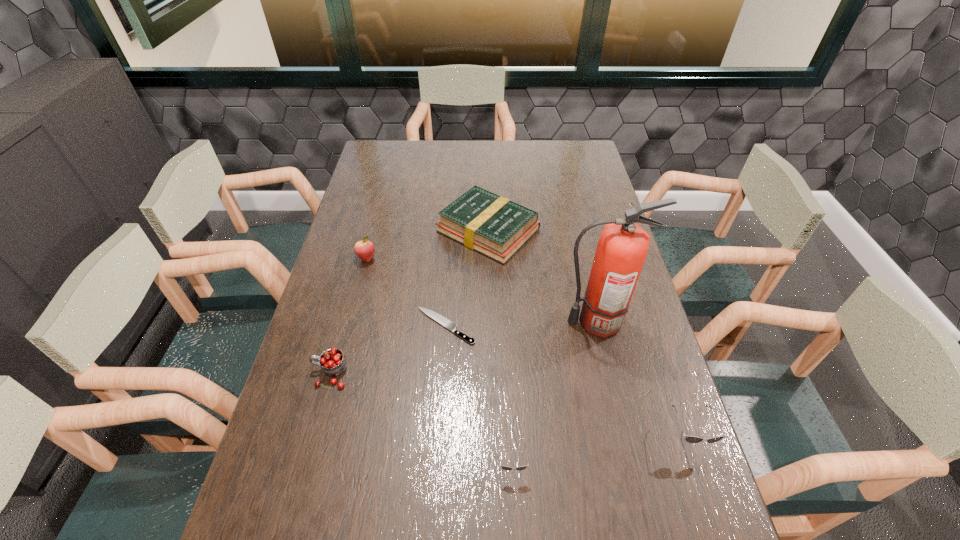
Locate an element on the screen. The width and height of the screenshot is (960, 540). free spot that satisfies the following two spatial constraints: 1. on the handle side of the cherry; 2. on the back side of the hardback book is located at coordinates (370, 230).

You are a GUI agent. You are given a task and a screenshot of the screen. Output one action in this format:
    pyautogui.click(x=<x>, y=<y>)
    Task: Click on the vacant region that satisfies the following two spatial constraints: 1. on the handle side of the cherry; 2. on the back side of the apple
    This screenshot has height=540, width=960.
    Given the screenshot: What is the action you would take?
    [x=362, y=259]